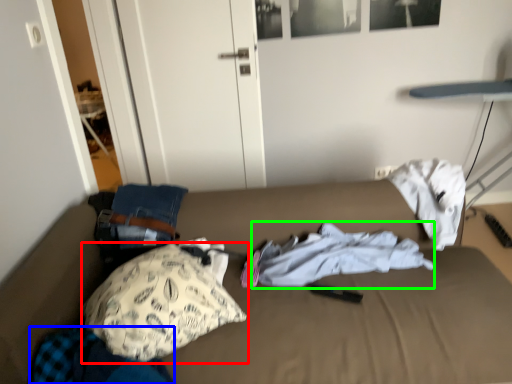
Question: Considering the real-world distances, which object is closest to pillow (highlighted by a red box)? clothing (highlighted by a blue box) or clothing (highlighted by a green box).

Choices:
 (A) clothing
 (B) clothing

Answer: (A)